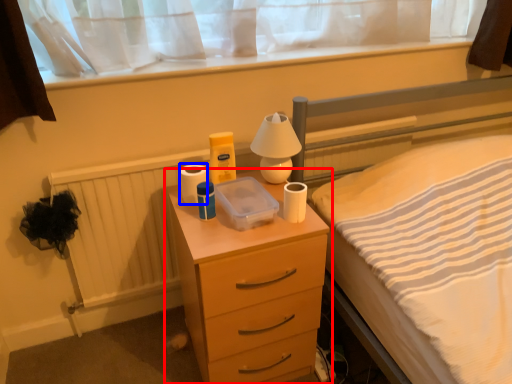
Question: Which object appears closest to the camera in this image, chest of drawers (highlighted by a red box) or toilet paper (highlighted by a blue box)?

Choices:
 (A) chest of drawers
 (B) toilet paper

Answer: (A)